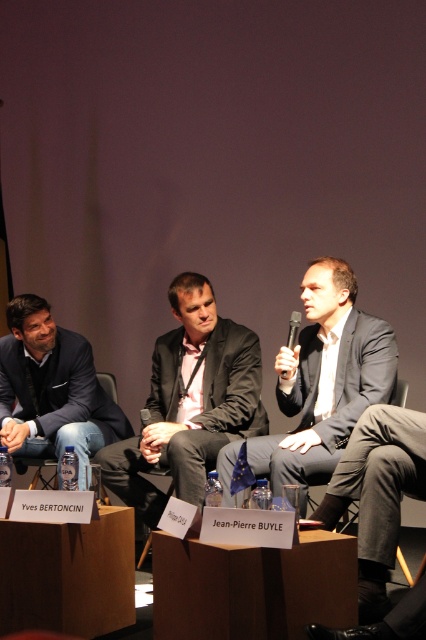
In the panel discussion scene, there are three individuals seated on stage. The person on the left is wearing a dark suit jacket over a light shirt and jeans, the center person has a dark blazer over a pink shirt, and the third person is on the right. You are standing at point (218, 408). Which individual are you closest to?

The dark gray suit at center is located at point (218, 408), so you are closest to the center individual wearing the dark blazer over a pink shirt.